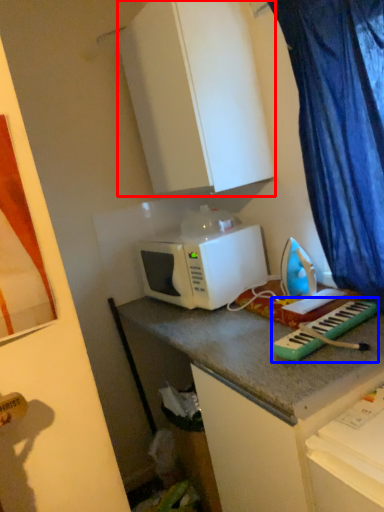
Question: Which point is further to the camera, cabinetry (highlighted by a red box) or musical keyboard (highlighted by a blue box)?

Choices:
 (A) cabinetry
 (B) musical keyboard

Answer: (A)